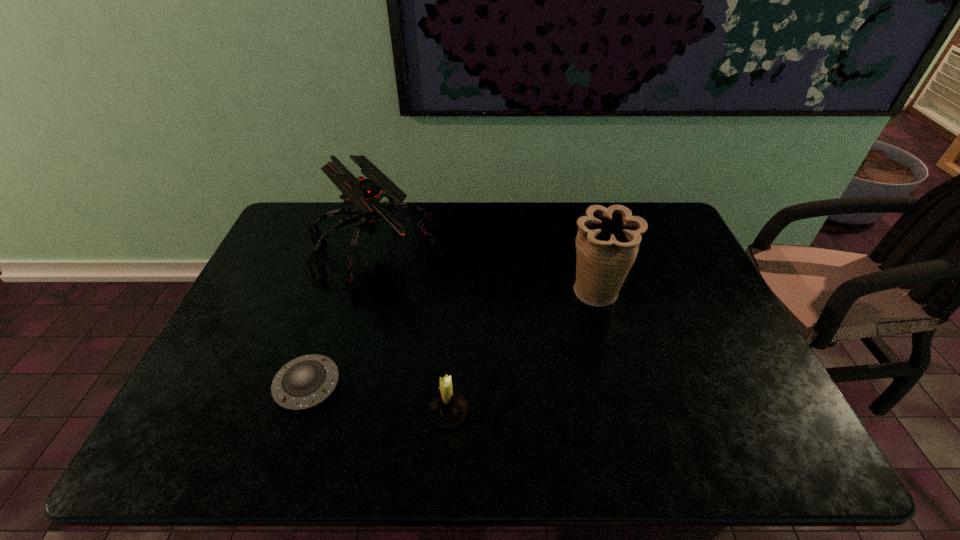
The width and height of the screenshot is (960, 540). I want to click on object that is positioned at the near edge, so click(448, 409).

Where is `object that is at the left edge`? object that is at the left edge is located at coordinates (365, 195).

Identify the location of object present at the far left corner. Image resolution: width=960 pixels, height=540 pixels. (365, 195).

Image resolution: width=960 pixels, height=540 pixels. In the image, there is a desktop. Find the location of `free region at the far edge`. free region at the far edge is located at coordinates (492, 225).

Identify the location of free space at the near edge. This screenshot has width=960, height=540. (587, 441).

In the image, there is a desktop. Where is `vacant space at the left edge`? vacant space at the left edge is located at coordinates 218,402.

I want to click on free location at the right edge of the desktop, so click(x=777, y=418).

Identify the location of empty space that is in between the urn and the second shortest object. pyautogui.click(x=522, y=353).

Where is `vacant point located between the drone and the rightmost object`? The height and width of the screenshot is (540, 960). vacant point located between the drone and the rightmost object is located at coordinates (486, 271).

Image resolution: width=960 pixels, height=540 pixels. I want to click on free space between the drone and the shortest object, so click(342, 317).